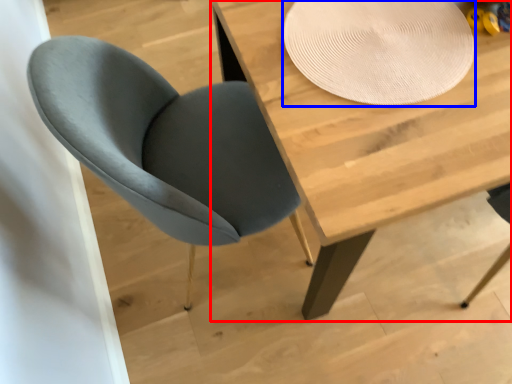
Question: Which point is closer to the camera, table (highlighted by a red box) or paper plate (highlighted by a blue box)?

Choices:
 (A) table
 (B) paper plate

Answer: (A)